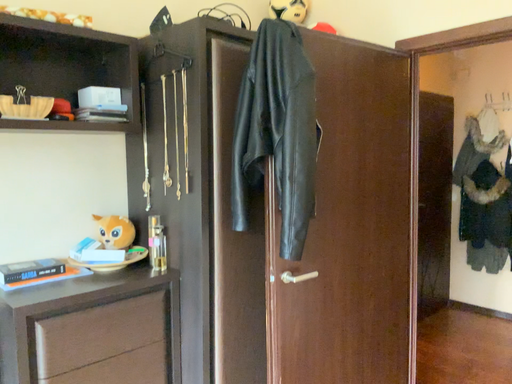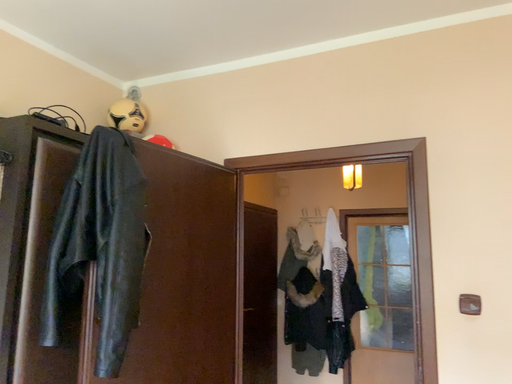
Question: Which way did the camera rotate in the video?

Choices:
 (A) rotated left
 (B) rotated right

Answer: (B)